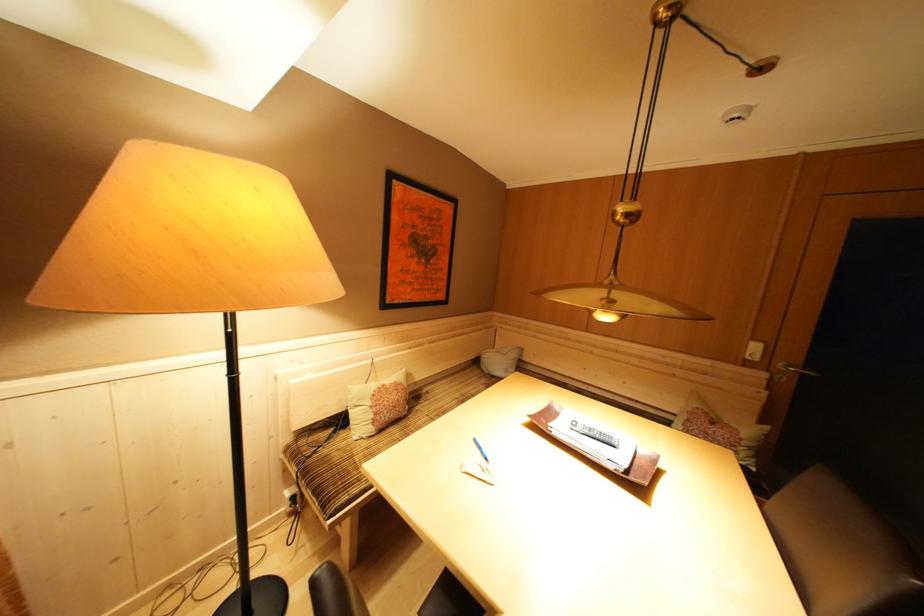
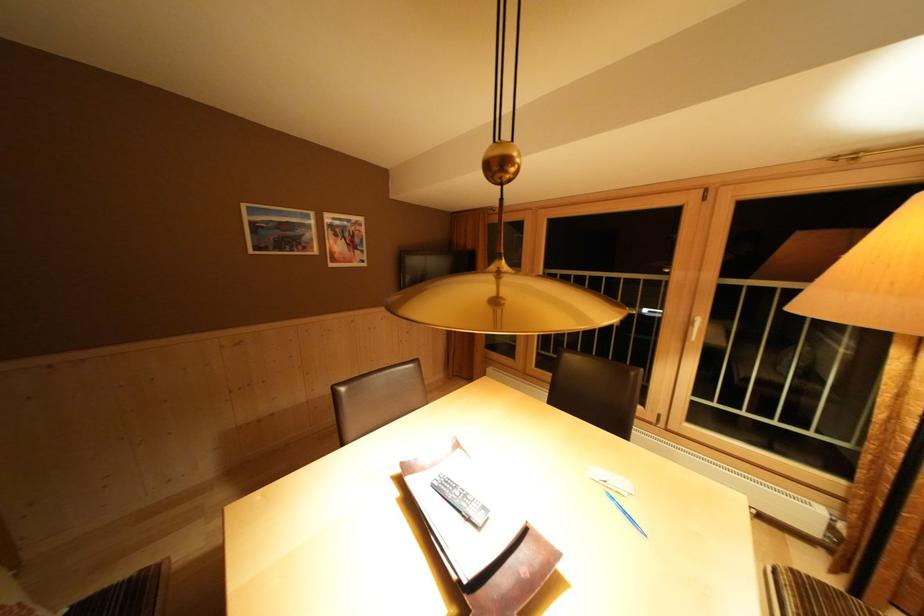
In the second image, find the point that corresponds to point (487, 453) in the first image.

(633, 517)